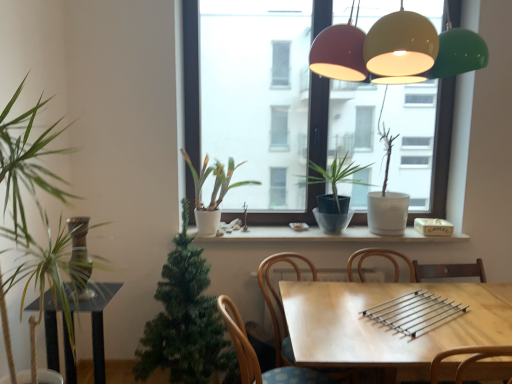
Question: Does white matte plant at center, positioned as the third houseplant in right-to-left order, appear on the right side of matte glass lampshades at upper center?

Choices:
 (A) no
 (B) yes

Answer: (A)

Question: Is white matte plant at center, placed as the 3th houseplant when sorted from left to right, facing towards matte glass lampshades at upper center?

Choices:
 (A) no
 (B) yes

Answer: (A)

Question: Can you confirm if white matte plant at center, placed as the 3th houseplant when sorted from left to right, is thinner than matte glass lampshades at upper center?

Choices:
 (A) no
 (B) yes

Answer: (B)

Question: Can you confirm if white matte plant at center, placed as the 3th houseplant when sorted from left to right, is bigger than matte glass lampshades at upper center?

Choices:
 (A) no
 (B) yes

Answer: (A)

Question: From a real-world perspective, is white matte plant at center, positioned as the third houseplant in right-to-left order, over matte glass lampshades at upper center?

Choices:
 (A) yes
 (B) no

Answer: (B)

Question: Considering the positions of green leafy plant at left, placed as the first houseplant when sorted from left to right, and matte glass lampshades at upper center in the image, is green leafy plant at left, placed as the first houseplant when sorted from left to right, taller or shorter than matte glass lampshades at upper center?

Choices:
 (A) short
 (B) tall

Answer: (B)

Question: Is green leafy plant at left, placed as the first houseplant when sorted from left to right, wider or thinner than matte glass lampshades at upper center?

Choices:
 (A) wide
 (B) thin

Answer: (B)

Question: From a real-world perspective, is green leafy plant at left, positioned as the fifth houseplant in right-to-left order, above or below matte glass lampshades at upper center?

Choices:
 (A) above
 (B) below

Answer: (B)

Question: Considering their positions, is green leafy plant at left, positioned as the fifth houseplant in right-to-left order, located in front of or behind matte glass lampshades at upper center?

Choices:
 (A) front
 (B) behind

Answer: (B)

Question: Does point (335, 188) appear closer or farther from the camera than point (337, 238)?

Choices:
 (A) farther
 (B) closer

Answer: (B)

Question: From a real-world perspective, is green matte plant at center, marked as the 4th houseplant in a left-to-right arrangement, above or below white ceramic window sill at center?

Choices:
 (A) below
 (B) above

Answer: (B)

Question: From the image's perspective, is green matte plant at center, the 2th houseplant positioned from the right, located above or below white ceramic window sill at center?

Choices:
 (A) above
 (B) below

Answer: (A)

Question: Considering the positions of green matte plant at center, the 2th houseplant positioned from the right, and white ceramic window sill at center in the image, is green matte plant at center, the 2th houseplant positioned from the right, bigger or smaller than white ceramic window sill at center?

Choices:
 (A) small
 (B) big

Answer: (B)

Question: In the image, is white matte plant at center, positioned as the third houseplant in right-to-left order, positioned in front of or behind green matte plant at center, marked as the 4th houseplant in a left-to-right arrangement?

Choices:
 (A) behind
 (B) front

Answer: (A)

Question: From the image's perspective, is white matte plant at center, positioned as the third houseplant in right-to-left order, above or below green matte plant at center, marked as the 4th houseplant in a left-to-right arrangement?

Choices:
 (A) below
 (B) above

Answer: (B)